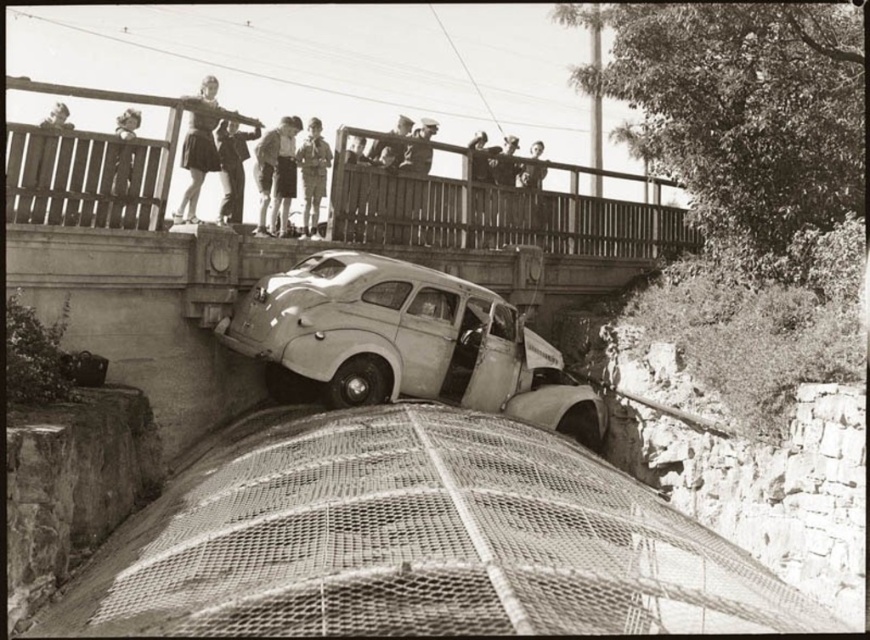
Question: Which point is closer to the camera?

Choices:
 (A) (117, 141)
 (B) (269, 150)
 (C) (218, 154)

Answer: (A)

Question: Can you confirm if light beige matte car at center is positioned to the right of light brown shorts at upper center?

Choices:
 (A) yes
 (B) no

Answer: (A)

Question: Which point appears closest to the camera in this image?

Choices:
 (A) (206, 152)
 (B) (242, 195)

Answer: (A)

Question: Which object is the closest to the smooth wooden fence at upper left?

Choices:
 (A) light skin tone shorts at upper center
 (B) light beige matte car at center

Answer: (A)

Question: Does light brown shorts at upper center have a lesser width compared to light brown uniform at upper center?

Choices:
 (A) yes
 (B) no

Answer: (A)

Question: Is light brown leather jacket at upper center to the right of light brown uniform at center from the viewer's perspective?

Choices:
 (A) yes
 (B) no

Answer: (B)